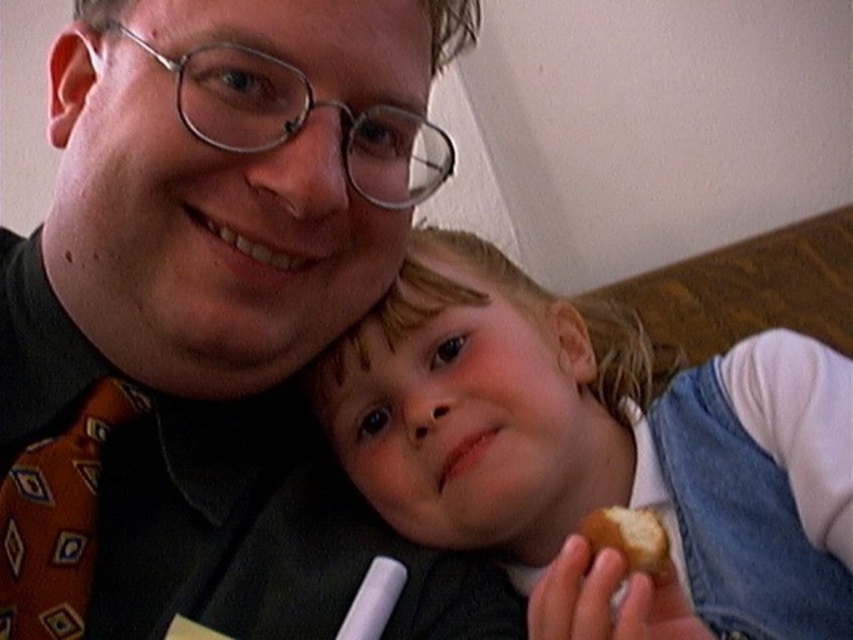
Can you confirm if smooth white shirt at center is taller than orange patterned tie at left?

Yes.

Does smooth white shirt at center appear on the right side of orange patterned tie at left?

Yes, smooth white shirt at center is to the right of orange patterned tie at left.

Does point (375, 477) come closer to viewer compared to point (68, 500)?

No.

Locate an element on the screen. The width and height of the screenshot is (853, 640). smooth white shirt at center is located at coordinates (596, 436).

Does point (109, 176) come farther from viewer compared to point (643, 547)?

Yes.

Can you confirm if matte black shirt at center is bigger than golden crumbly pastry at lower right?

Correct, matte black shirt at center is larger in size than golden crumbly pastry at lower right.

Does point (190, 376) lie in front of point (640, 518)?

No, it is behind (640, 518).

Locate an element on the screen. This screenshot has height=640, width=853. matte black shirt at center is located at coordinates (212, 321).

Between matte black shirt at center and smooth white shirt at center, which one is positioned higher?

matte black shirt at center is above.

Looking at this image, can you confirm if matte black shirt at center is taller than smooth white shirt at center?

Yes.

Is point (120, 147) positioned in front of point (757, 630)?

Yes, it is in front of point (757, 630).

You are a GUI agent. You are given a task and a screenshot of the screen. Output one action in this format:
    pyautogui.click(x=<x>, y=<y>)
    Task: Click on the matte black shirt at center
    The image size is (853, 640).
    Given the screenshot: What is the action you would take?
    pyautogui.click(x=212, y=321)